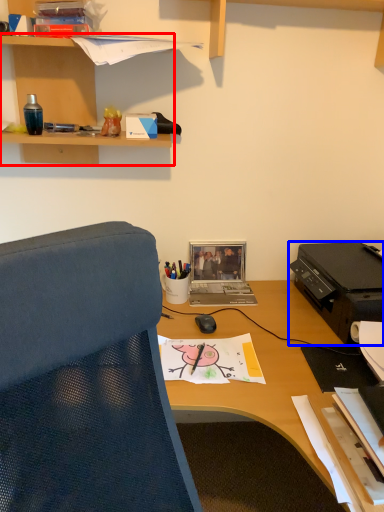
Question: Which point is closer to the camera, shelf (highlighted by a red box) or printer (highlighted by a blue box)?

Choices:
 (A) shelf
 (B) printer

Answer: (A)